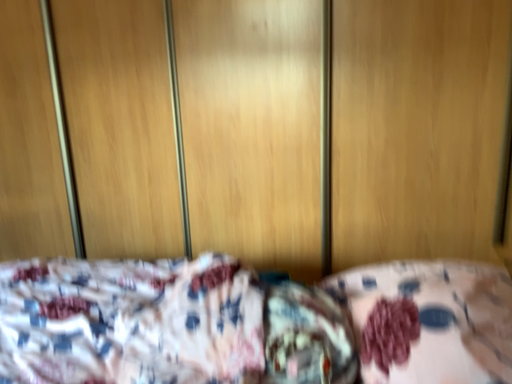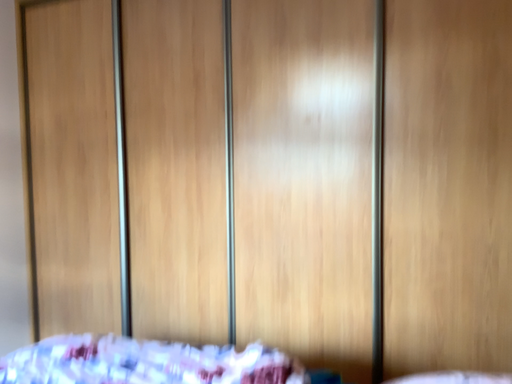
Question: How did the camera likely rotate when shooting the video?

Choices:
 (A) rotated downward
 (B) rotated upward

Answer: (B)